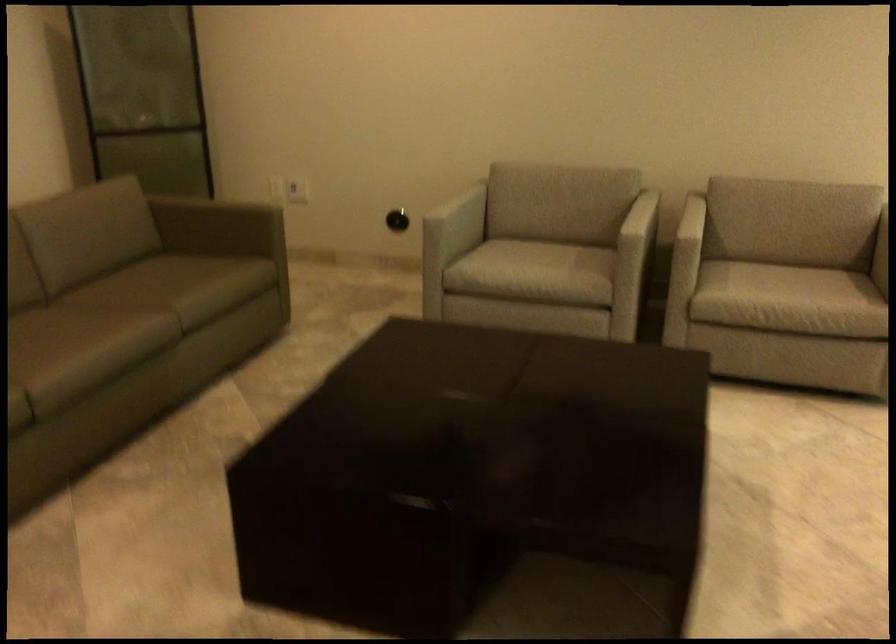
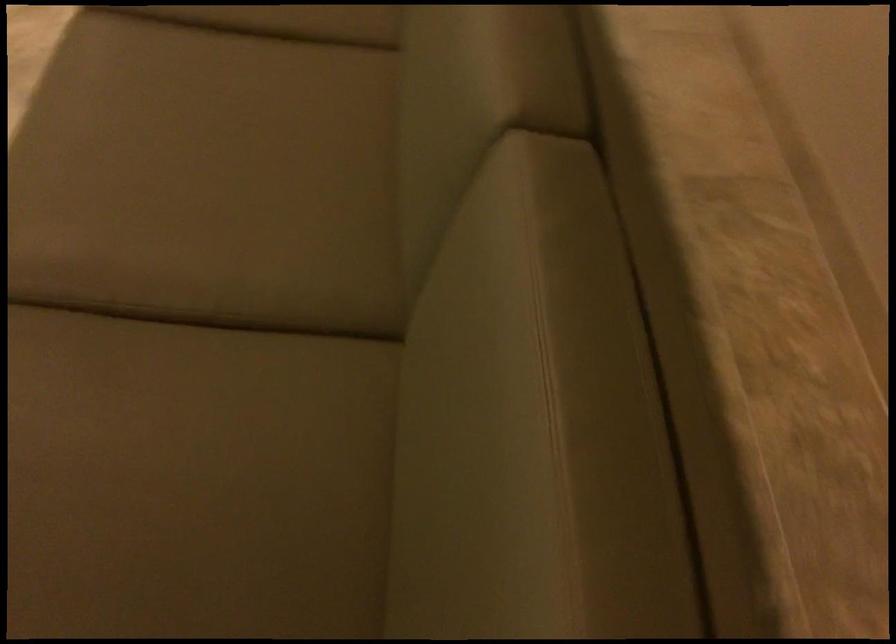
Where in the second image is the point corresponding to (x=85, y=306) from the first image?

(211, 339)